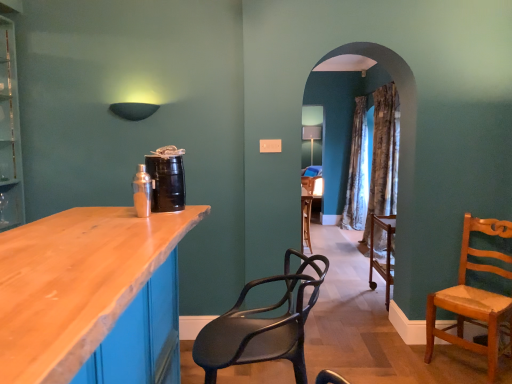
Question: Considering the relative positions of matte black chair at center, which is counted as the first chair, starting from the left, and light brown wooden chair at right, arranged as the 1th chair when viewed from the back, in the image provided, is matte black chair at center, which is counted as the first chair, starting from the left, to the right of light brown wooden chair at right, arranged as the 1th chair when viewed from the back, from the viewer's perspective?

Choices:
 (A) yes
 (B) no

Answer: (B)

Question: Considering the relative sizes of matte black chair at center, which is the first chair from front to back, and light brown wooden chair at right, marked as the 1th chair in a right-to-left arrangement, in the image provided, is matte black chair at center, which is the first chair from front to back, smaller than light brown wooden chair at right, marked as the 1th chair in a right-to-left arrangement,?

Choices:
 (A) no
 (B) yes

Answer: (B)

Question: Is matte black chair at center, the second chair positioned from the right, turned away from light brown wooden chair at right, the 2th chair from the left?

Choices:
 (A) yes
 (B) no

Answer: (B)

Question: Is the position of matte black chair at center, the second chair positioned from the right, less distant than that of light brown wooden chair at right, arranged as the 1th chair when viewed from the back?

Choices:
 (A) yes
 (B) no

Answer: (A)

Question: Is matte black chair at center, which is counted as the first chair, starting from the left, to the left of light brown wooden chair at right, marked as the 1th chair in a right-to-left arrangement, from the viewer's perspective?

Choices:
 (A) no
 (B) yes

Answer: (B)

Question: Is matte black chair at center, the second chair positioned from the right, bigger than light brown wooden chair at right, the 2th chair from the left?

Choices:
 (A) no
 (B) yes

Answer: (A)

Question: From a real-world perspective, is matte black chair at center, the second chair positioned from the right, positioned over patterned fabric curtain at center based on gravity?

Choices:
 (A) no
 (B) yes

Answer: (A)

Question: Can you confirm if matte black chair at center, the second chair positioned from the right, is smaller than patterned fabric curtain at center?

Choices:
 (A) no
 (B) yes

Answer: (B)

Question: Can you confirm if matte black chair at center, which is the first chair from front to back, is positioned to the left of patterned fabric curtain at center?

Choices:
 (A) yes
 (B) no

Answer: (A)

Question: Is matte black chair at center, which is counted as the first chair, starting from the left, not close to patterned fabric curtain at center?

Choices:
 (A) no
 (B) yes

Answer: (B)

Question: From the image's perspective, would you say matte black chair at center, which is counted as the 2th chair, starting from the back, is shown under patterned fabric curtain at center?

Choices:
 (A) no
 (B) yes

Answer: (B)

Question: Is matte black chair at center, which is counted as the first chair, starting from the left, completely or partially outside of patterned fabric curtain at center?

Choices:
 (A) no
 (B) yes

Answer: (B)

Question: Is patterned fabric curtain at center in front of matte black chair at center, the second chair positioned from the right?

Choices:
 (A) yes
 (B) no

Answer: (B)